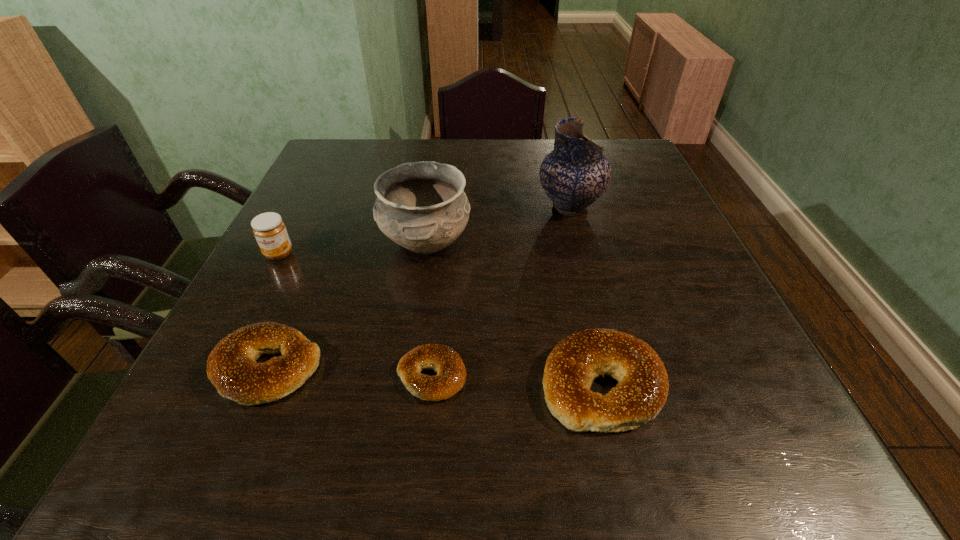
Where is `free space located 0.380m on the back of the second shortest bagel`? This screenshot has width=960, height=540. free space located 0.380m on the back of the second shortest bagel is located at coordinates (333, 213).

This screenshot has width=960, height=540. In order to click on free space located 0.320m on the right of the shortest bagel in this screenshot , I will do `click(657, 376)`.

At what (x,y) coordinates should I click in order to perform the action: click on free space located on the back of the rightmost bagel. Please return your answer as a coordinate pair (x, y). Image resolution: width=960 pixels, height=540 pixels. Looking at the image, I should click on (573, 264).

The height and width of the screenshot is (540, 960). Find the location of `free space located 0.090m on the right of the right pottery`. free space located 0.090m on the right of the right pottery is located at coordinates (638, 207).

You are a GUI agent. You are given a task and a screenshot of the screen. Output one action in this format:
    pyautogui.click(x=<x>, y=<y>)
    Task: Click on the vacant space located 0.170m on the front label of the jam
    The height and width of the screenshot is (540, 960).
    Given the screenshot: What is the action you would take?
    pyautogui.click(x=243, y=323)

Locate an element on the screen. vacant space located on the back of the left pottery is located at coordinates (439, 155).

The height and width of the screenshot is (540, 960). I want to click on bagel present at the left edge, so click(231, 366).

I want to click on jam present at the left edge, so click(269, 229).

This screenshot has width=960, height=540. I want to click on object that is at the near left corner, so click(231, 366).

Find the location of a particular element. This screenshot has width=960, height=540. free spot at the far edge of the desktop is located at coordinates (492, 154).